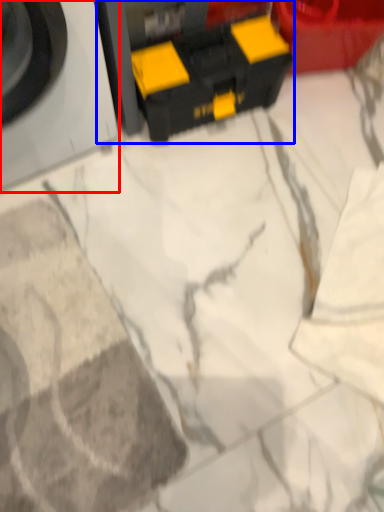
Question: Which point is further to the camera, washing machine (highlighted by a red box) or toy (highlighted by a blue box)?

Choices:
 (A) washing machine
 (B) toy

Answer: (B)